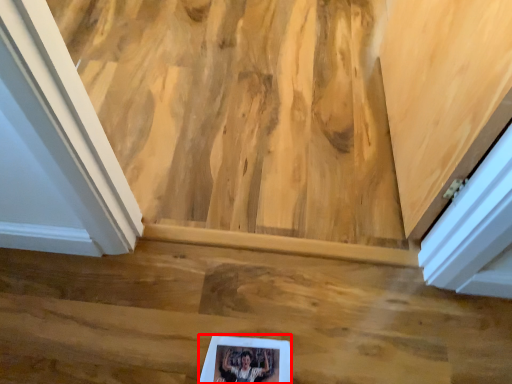
Question: Where is picture frame (annotated by the red box) located in relation to stairwell in the image?

Choices:
 (A) right
 (B) left

Answer: (B)